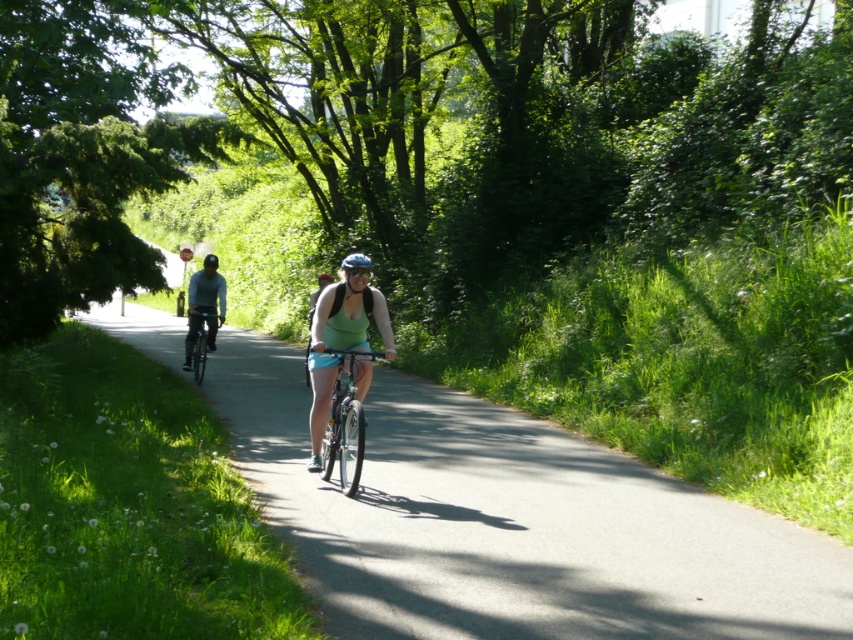
Question: Does shiny metallic bicycle at center have a greater width compared to blue matte bicycle helmet at center?

Choices:
 (A) no
 (B) yes

Answer: (A)

Question: Estimate the real-world distances between objects in this image. Which object is closer to the shiny black bicycle at center?

Choices:
 (A) blue matte bicycle helmet at center
 (B) asphalt road at center

Answer: (B)

Question: Which point is farther to the camera?

Choices:
 (A) (364, 262)
 (B) (666, 481)
 (C) (323, 465)

Answer: (B)

Question: Can you confirm if shiny metallic bicycle at center is positioned to the right of blue matte bicycle helmet at center?

Choices:
 (A) yes
 (B) no

Answer: (A)

Question: Which object is farther from the camera taking this photo?

Choices:
 (A) blue matte bicycle helmet at center
 (B) shiny metallic bicycle at center
 (C) shiny black bicycle at center
 (D) asphalt road at center

Answer: (C)

Question: Can you confirm if asphalt road at center is bigger than shiny metallic bicycle at center?

Choices:
 (A) yes
 (B) no

Answer: (A)